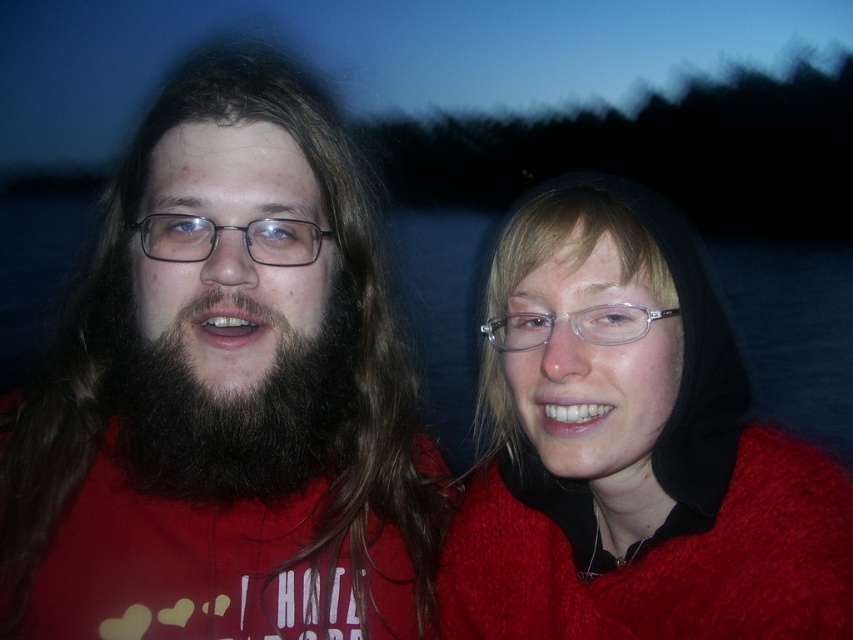
You are standing at the point labeled point (573, 292). You want to walk directly towards the viewer. How far will you have to walk to reach the viewer?

The point labeled point (573, 292) is 37.58 inches away from the viewer, so you will have to walk 37.58 inches to reach the viewer.

Based on the photo, you are a photographer adjusting the focus on your camera. You notice the matte black beard at left and the matte black glasses at left in the frame. Which object should you focus on first if you want to ensure both are in focus, considering their positions?

The matte black beard at left is below the matte black glasses at left, so you should focus on the matte black glasses at left first to ensure both are in focus.

You are trying to decide which item to grab first from the scene. The matte red sweater at right and the matte black glasses at left are both within reach. Based on their sizes, which one do you think is larger?

The matte red sweater at right might be wider than matte black glasses at left, so it is likely larger in size.